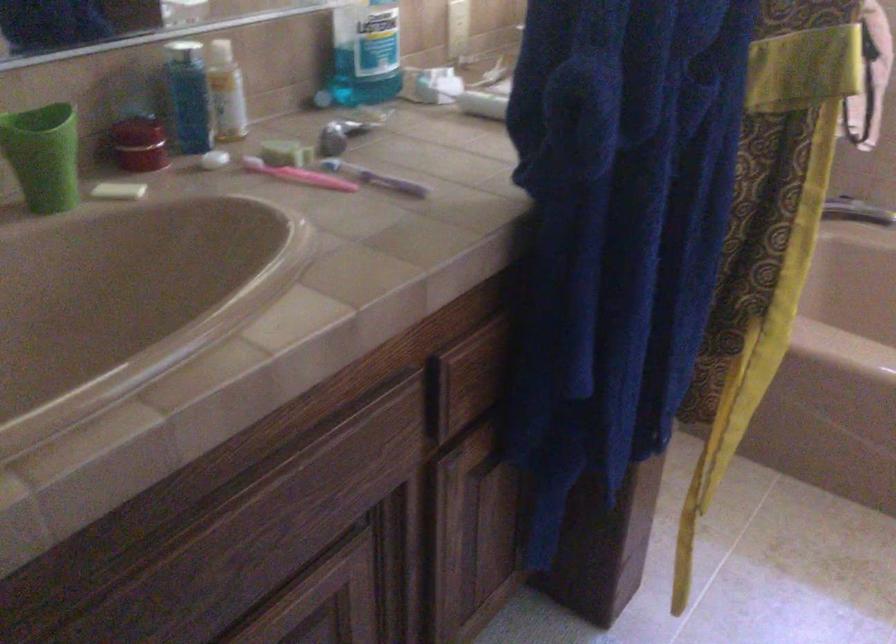
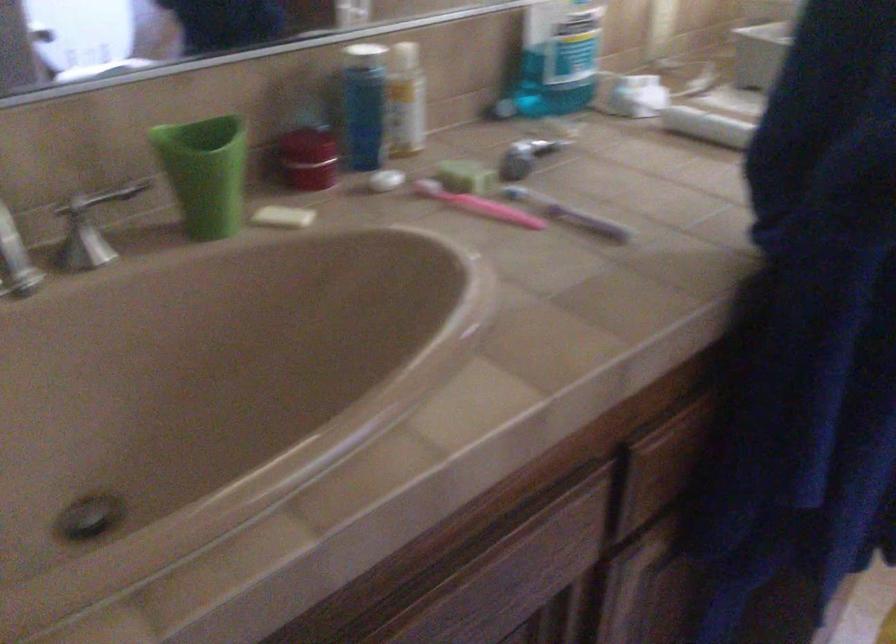
Question: The first image is from the beginning of the video and the second image is from the end. How did the camera likely rotate when shooting the video?

Choices:
 (A) Left
 (B) Right
 (C) Up
 (D) Down

Answer: (A)